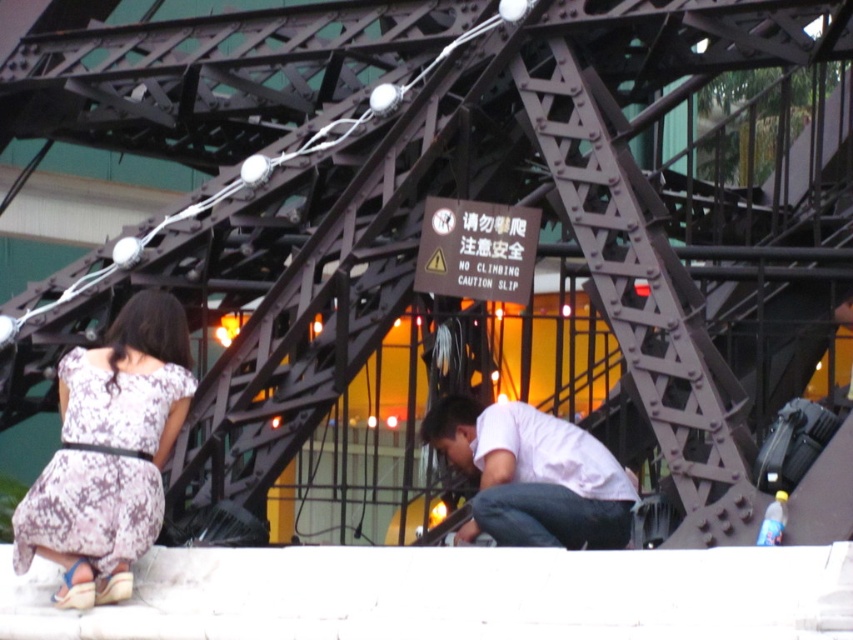
Question: Which point appears closest to the camera in this image?

Choices:
 (A) pyautogui.click(x=535, y=461)
 (B) pyautogui.click(x=93, y=477)

Answer: (B)

Question: Is floral print fabric dress at lower left bigger than white matte shirt at lower center?

Choices:
 (A) no
 (B) yes

Answer: (B)

Question: Is floral print fabric dress at lower left positioned in front of white matte shirt at lower center?

Choices:
 (A) no
 (B) yes

Answer: (B)

Question: Observing the image, what is the correct spatial positioning of floral print fabric dress at lower left in reference to white matte shirt at lower center?

Choices:
 (A) right
 (B) left

Answer: (B)

Question: Which point is closer to the camera taking this photo?

Choices:
 (A) (126, 376)
 (B) (572, 516)

Answer: (B)